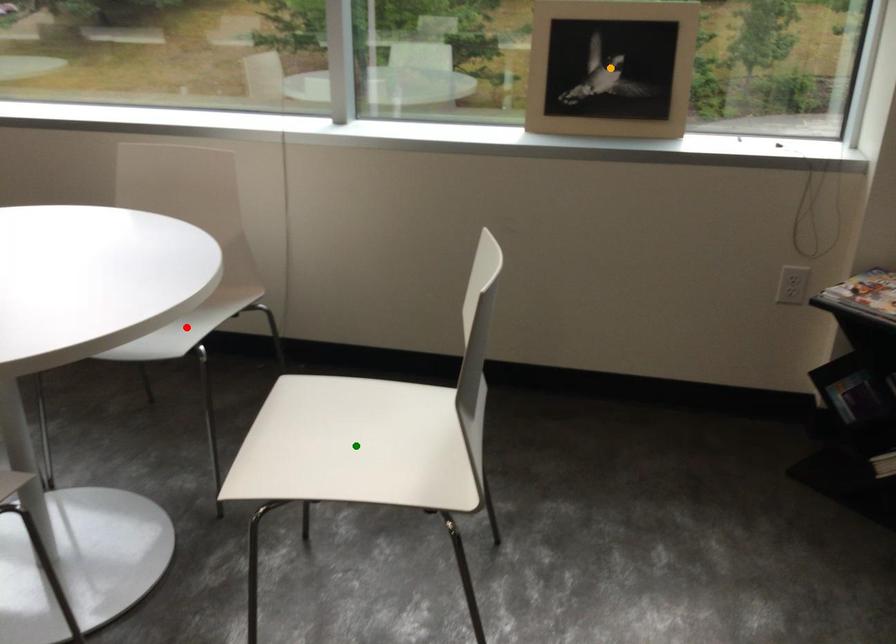
Order these from nearest to farthest:
green point | red point | orange point

green point < red point < orange point